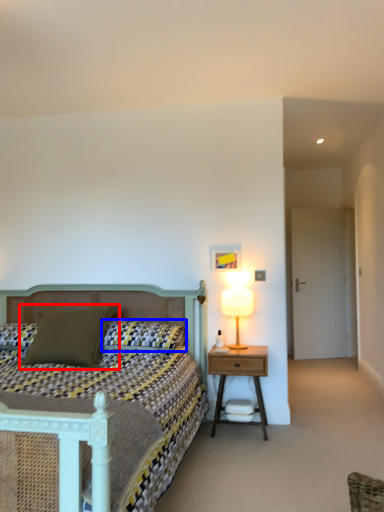
Question: Among these objects, which one is nearest to the camera, pillow (highlighted by a red box) or pillow (highlighted by a blue box)?

Choices:
 (A) pillow
 (B) pillow

Answer: (A)